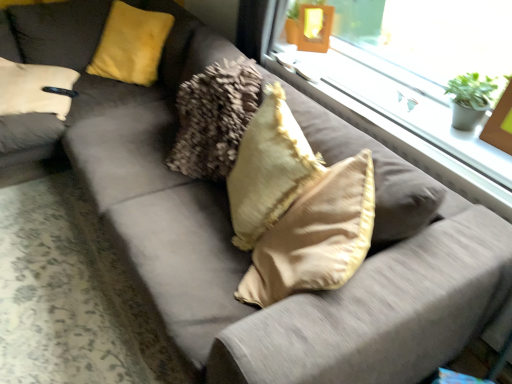
Question: Does yellow fuzzy pillow at upper left, which is counted as the 2th pillow, starting from the bottom, turn towards beige soft cushion at center, placed as the first pillow when sorted from front to back?

Choices:
 (A) yes
 (B) no

Answer: (B)

Question: Is yellow fuzzy pillow at upper left, which is counted as the 2th pillow, starting from the bottom, shorter than beige soft cushion at center, the first pillow positioned from the right?

Choices:
 (A) yes
 (B) no

Answer: (A)

Question: Is yellow fuzzy pillow at upper left, which is counted as the 2th pillow, starting from the front, far from beige soft cushion at center, positioned as the second pillow in left-to-right order?

Choices:
 (A) no
 (B) yes

Answer: (B)

Question: Is yellow fuzzy pillow at upper left, arranged as the first pillow when viewed from the left, further to camera compared to beige soft cushion at center, which ranks as the 2th pillow in top-to-bottom order?

Choices:
 (A) yes
 (B) no

Answer: (A)

Question: Does yellow fuzzy pillow at upper left, which is counted as the 2th pillow, starting from the front, have a smaller size compared to beige soft cushion at center, which ranks as the 1th pillow in bottom-to-top order?

Choices:
 (A) no
 (B) yes

Answer: (A)

Question: Can you confirm if yellow fuzzy pillow at upper left, the 1th pillow in the top-to-bottom sequence, is positioned to the right of beige soft cushion at center, arranged as the 2th pillow when viewed from the back?

Choices:
 (A) yes
 (B) no

Answer: (B)

Question: Can you confirm if clear glass window at upper right is thinner than wooden picture frame at upper right?

Choices:
 (A) yes
 (B) no

Answer: (B)

Question: Considering the relative positions of clear glass window at upper right and wooden picture frame at upper right in the image provided, is clear glass window at upper right in front of wooden picture frame at upper right?

Choices:
 (A) no
 (B) yes

Answer: (A)

Question: Can you confirm if clear glass window at upper right is positioned to the right of wooden picture frame at upper right?

Choices:
 (A) no
 (B) yes

Answer: (A)

Question: Are clear glass window at upper right and wooden picture frame at upper right beside each other?

Choices:
 (A) yes
 (B) no

Answer: (B)

Question: Would you consider clear glass window at upper right to be distant from wooden picture frame at upper right?

Choices:
 (A) yes
 (B) no

Answer: (B)

Question: Can you confirm if clear glass window at upper right is taller than wooden picture frame at upper right?

Choices:
 (A) yes
 (B) no

Answer: (B)

Question: Is yellow fuzzy pillow at upper left, which is counted as the 2th pillow, starting from the front, completely or partially inside green matte houseplant at upper right?

Choices:
 (A) no
 (B) yes

Answer: (A)